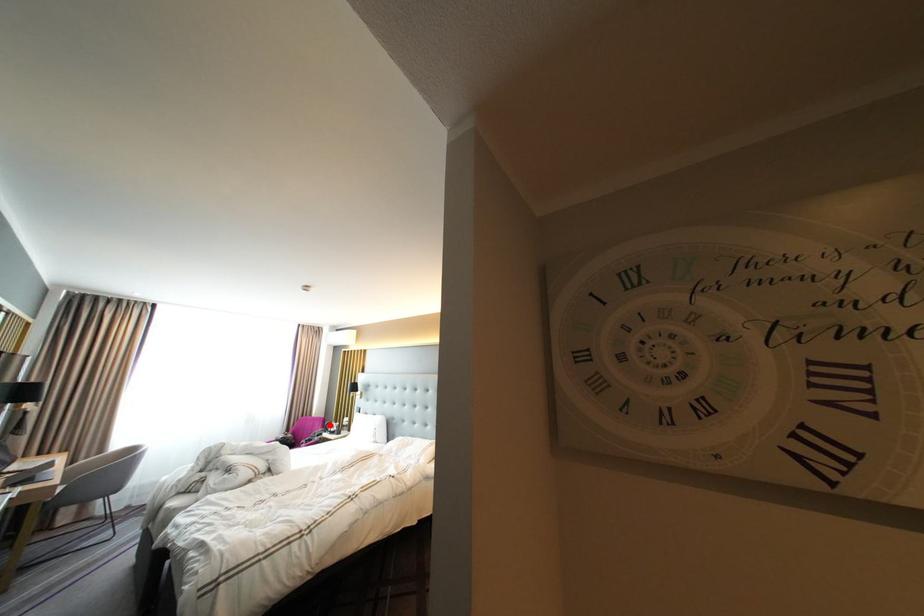
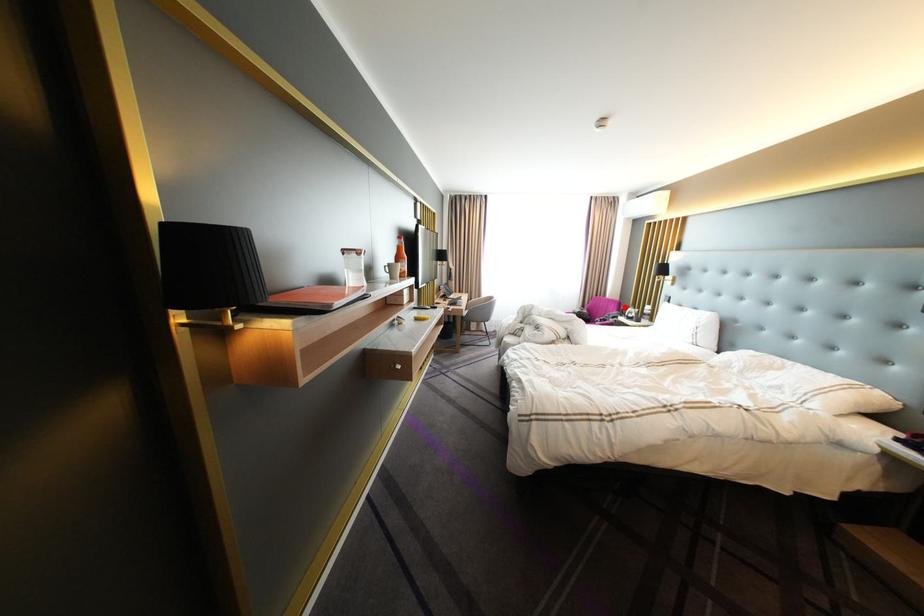
I am providing you with two images of the same scene from different viewpoints. A red point is marked on the first image and another point is marked on the second image. Is the marked point in image1 the same physical position as the marked point in image2?

Yes